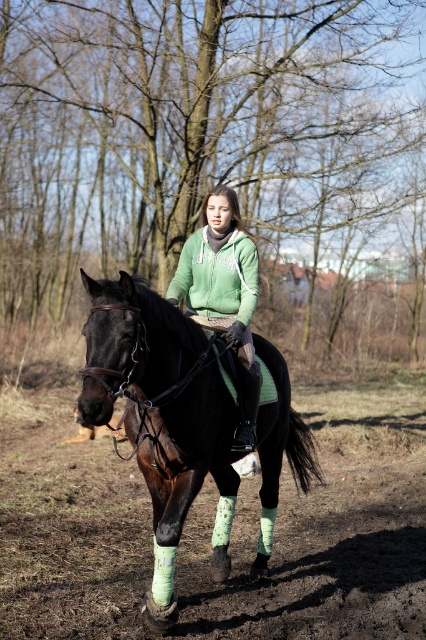
Does point (14, 557) lie behind point (109, 282)?

That is True.

Does dull brown dirt at lower center appear under shiny black horse at center?

Correct, dull brown dirt at lower center is located below shiny black horse at center.

Locate an element on the screen. The width and height of the screenshot is (426, 640). dull brown dirt at lower center is located at coordinates (325, 529).

The image size is (426, 640). What do you see at coordinates (325, 529) in the screenshot?
I see `dull brown dirt at lower center` at bounding box center [325, 529].

Identify the location of dull brown dirt at lower center. The image size is (426, 640). (x=325, y=529).

Is shiny black horse at center to the right of green fleece jacket at center from the viewer's perspective?

Yes, shiny black horse at center is to the right of green fleece jacket at center.

Can you confirm if shiny black horse at center is taller than green fleece jacket at center?

Indeed, shiny black horse at center has a greater height compared to green fleece jacket at center.

Does point (198, 380) lie in front of point (198, 314)?

Yes, point (198, 380) is in front of point (198, 314).

This screenshot has height=640, width=426. In order to click on shiny black horse at center in this screenshot , I will do `click(158, 412)`.